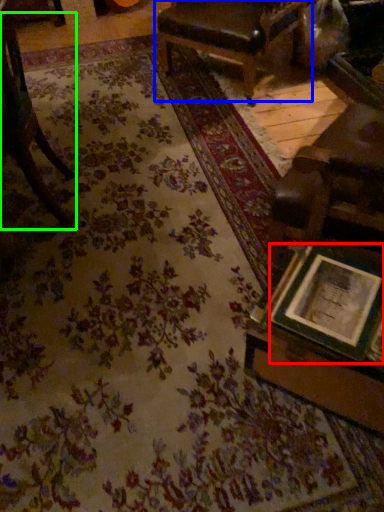
Question: Which is nearer to the picture frame (highlighted by a red box)? chair (highlighted by a blue box) or chair (highlighted by a green box).

Choices:
 (A) chair
 (B) chair

Answer: (B)